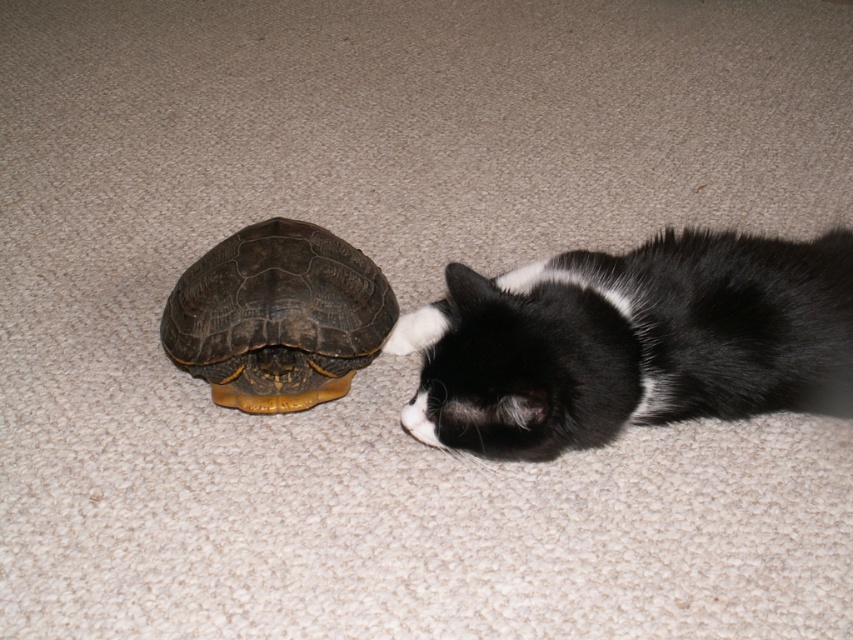
You are a robotic pet sitter in a room with a black fur cat at right. You need to place a treat bowl for the cat. Where should you place it relative to the cat?

The black fur cat at right is located at coordinates point (631,340), so you should place the treat bowl near that position to ensure the cat can easily access it.

You are a photographer trying to capture a clear shot of both the black fur cat at right and the brown textured shell at center. Since you want both subjects in focus, which one should you adjust your camera focus on first?

You should focus on the brown textured shell at center first because the black fur cat at right is closer to the viewer than the brown textured shell at center, so adjusting focus starting from the farther object ensures both are in focus.